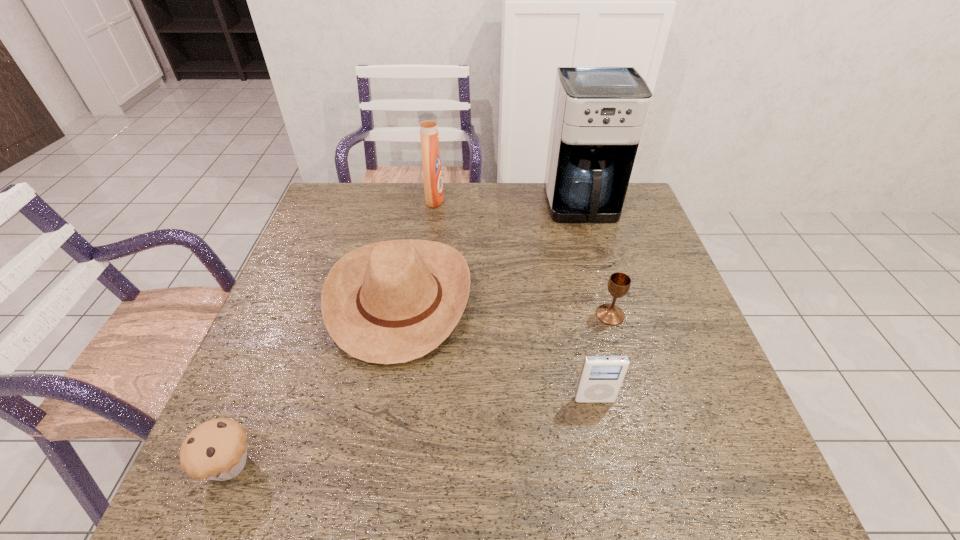
Where is `coffee maker`? The image size is (960, 540). coffee maker is located at coordinates (599, 112).

The height and width of the screenshot is (540, 960). I want to click on detergent, so click(x=432, y=172).

Identify the location of cowboy hat. Image resolution: width=960 pixels, height=540 pixels. (389, 302).

Locate an element on the screen. The width and height of the screenshot is (960, 540). iPod is located at coordinates (601, 377).

Locate an element on the screen. chalice is located at coordinates (619, 283).

This screenshot has width=960, height=540. In order to click on the leftmost object in this screenshot , I will do `click(217, 449)`.

What are the coordinates of `the nearest object` in the screenshot? It's located at (217, 449).

I want to click on vacant space located on the front panel of the tallest object, so click(602, 276).

Image resolution: width=960 pixels, height=540 pixels. I want to click on free space located on the front-facing side of the detergent, so click(480, 199).

You are a GUI agent. You are given a task and a screenshot of the screen. Output one action in this format:
    pyautogui.click(x=<x>, y=<y>)
    Task: Click on the free space located on the front-facing side of the cowboy hat
    
    Given the screenshot: What is the action you would take?
    pyautogui.click(x=572, y=299)